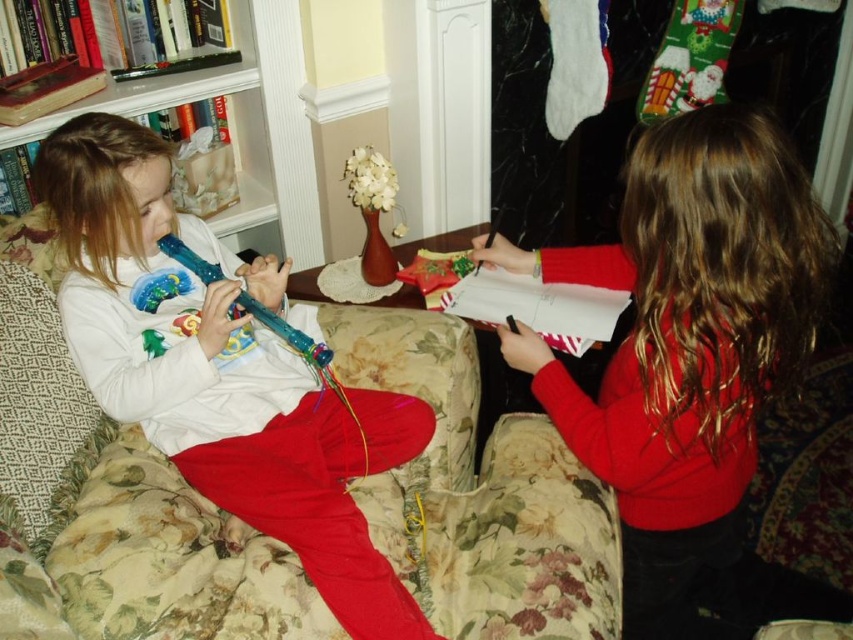
Question: Is matte red sweater at right above translucent plastic flute at left?

Choices:
 (A) yes
 (B) no

Answer: (B)

Question: Which object is closer to the camera taking this photo?

Choices:
 (A) translucent plastic flute at left
 (B) matte red sweater at right

Answer: (B)

Question: Among these points, which one is nearest to the camera?

Choices:
 (A) (718, 294)
 (B) (401, 634)

Answer: (A)

Question: Can you confirm if matte red sweater at right is positioned above translucent plastic flute at left?

Choices:
 (A) yes
 (B) no

Answer: (B)

Question: Is matte red sweater at right bigger than translucent plastic flute at left?

Choices:
 (A) no
 (B) yes

Answer: (B)